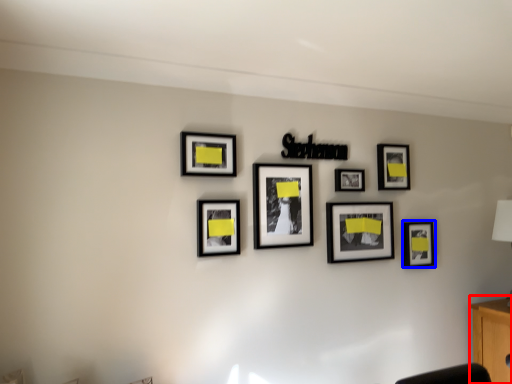
Question: Among these objects, which one is nearest to the camera, computer desk (highlighted by a red box) or picture frame (highlighted by a blue box)?

Choices:
 (A) computer desk
 (B) picture frame

Answer: (A)